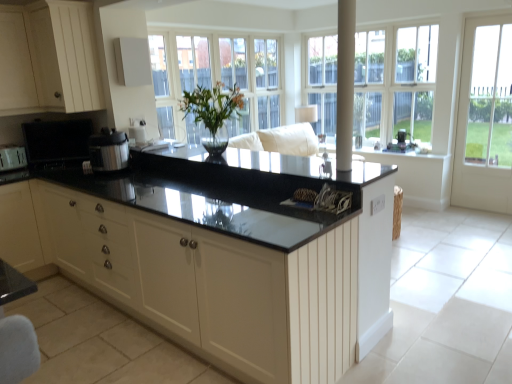
Question: Is satin silver pressure cooker at center, marked as the 3th appliance in a left-to-right arrangement, at the left side of clear glass windows at upper center?

Choices:
 (A) no
 (B) yes

Answer: (B)

Question: Considering the relative sizes of satin silver pressure cooker at center, acting as the fourth appliance starting from the back, and clear glass windows at upper center in the image provided, is satin silver pressure cooker at center, acting as the fourth appliance starting from the back, smaller than clear glass windows at upper center?

Choices:
 (A) no
 (B) yes

Answer: (B)

Question: Does satin silver pressure cooker at center, acting as the fourth appliance starting from the back, have a greater height compared to clear glass windows at upper center?

Choices:
 (A) yes
 (B) no

Answer: (B)

Question: Does satin silver pressure cooker at center, the 2th appliance from the right, appear on the right side of clear glass windows at upper center?

Choices:
 (A) no
 (B) yes

Answer: (A)

Question: Is satin silver pressure cooker at center, marked as the 3th appliance in a left-to-right arrangement, further to the viewer compared to clear glass windows at upper center?

Choices:
 (A) yes
 (B) no

Answer: (B)

Question: In terms of width, does white glass door at right look wider or thinner when compared to satin silver pressure cooker at center, the first appliance positioned from the front?

Choices:
 (A) thin
 (B) wide

Answer: (A)

Question: Is point (508, 54) closer or farther from the camera than point (96, 170)?

Choices:
 (A) farther
 (B) closer

Answer: (A)

Question: From a real-world perspective, is white glass door at right physically located above or below satin silver pressure cooker at center, the first appliance positioned from the front?

Choices:
 (A) above
 (B) below

Answer: (B)

Question: Considering the positions of white glass door at right and satin silver pressure cooker at center, the 2th appliance from the right, in the image, is white glass door at right taller or shorter than satin silver pressure cooker at center, the 2th appliance from the right,?

Choices:
 (A) tall
 (B) short

Answer: (A)

Question: Is white glossy pole at center wider or thinner than satin black speaker at upper right, which ranks as the fourth appliance in left-to-right order?

Choices:
 (A) thin
 (B) wide

Answer: (A)

Question: Considering their positions, is white glossy pole at center located in front of or behind satin black speaker at upper right, positioned as the first appliance in back-to-front order?

Choices:
 (A) front
 (B) behind

Answer: (A)

Question: Is white glossy pole at center taller or shorter than satin black speaker at upper right, positioned as the first appliance in back-to-front order?

Choices:
 (A) short
 (B) tall

Answer: (B)

Question: Is point (340, 14) positioned closer to the camera than point (410, 145)?

Choices:
 (A) farther
 (B) closer

Answer: (B)

Question: From a real-world perspective, is white wood cabinet at upper left above or below black granite countertop at center, arranged as the 2th countertop when ordered from the bottom?

Choices:
 (A) above
 (B) below

Answer: (A)

Question: From their relative heights in the image, would you say white wood cabinet at upper left is taller or shorter than black granite countertop at center, arranged as the 2th countertop when ordered from the bottom?

Choices:
 (A) tall
 (B) short

Answer: (A)